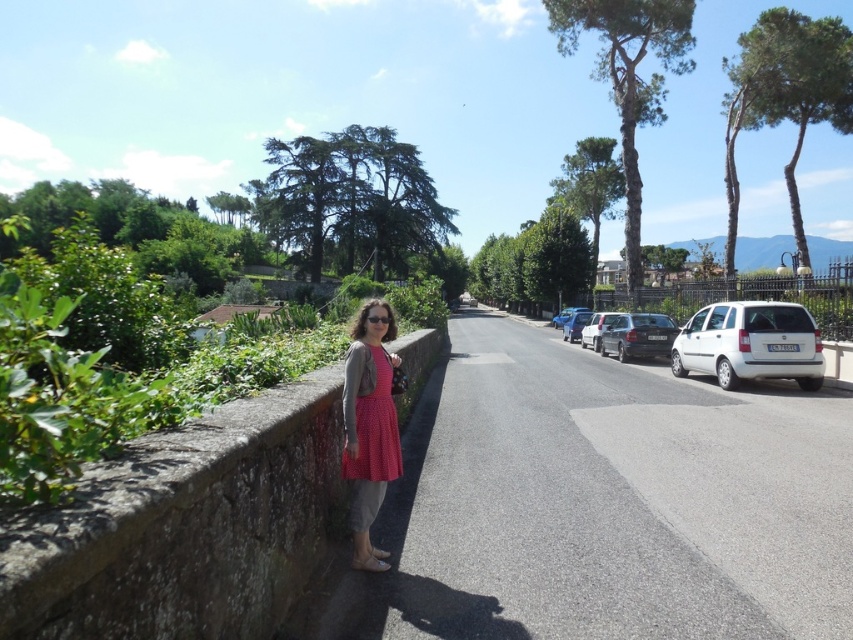
Is polka dot dress at center below white matte van at right?

No, polka dot dress at center is not below white matte van at right.

Is polka dot dress at center taller than white matte van at right?

No, polka dot dress at center is not taller than white matte van at right.

Identify the location of polka dot dress at center. The height and width of the screenshot is (640, 853). (369, 426).

The height and width of the screenshot is (640, 853). Find the location of `polka dot dress at center`. polka dot dress at center is located at coordinates (369, 426).

Does white matte van at right have a lesser width compared to white metallic car at center-right?

No.

Find the location of `white matte van at right`. white matte van at right is located at coordinates (750, 342).

Is white metallic car at center-right positioned before metallic silver car at center-right?

Yes, white metallic car at center-right is in front of metallic silver car at center-right.

Does white metallic car at center-right have a smaller size compared to metallic silver car at center-right?

Yes, white metallic car at center-right is smaller than metallic silver car at center-right.

Where is `white metallic car at center-right`? white metallic car at center-right is located at coordinates (596, 328).

Locate an element on the screen. white metallic car at center-right is located at coordinates (596, 328).